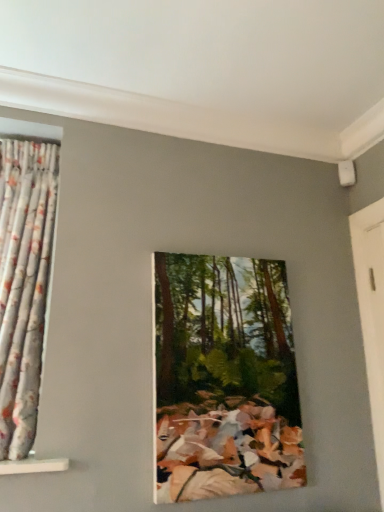
Question: Is white wooden door at right wider or thinner than oil painting of forest at center?

Choices:
 (A) thin
 (B) wide

Answer: (A)

Question: Based on their positions, is white wooden door at right located to the left or right of oil painting of forest at center?

Choices:
 (A) right
 (B) left

Answer: (A)

Question: Based on their relative distances, which object is nearer to the oil painting of forest at center?

Choices:
 (A) white wooden door at right
 (B) floral fabric curtain at left

Answer: (B)

Question: Estimate the real-world distances between objects in this image. Which object is closer to the white wooden door at right?

Choices:
 (A) oil painting of forest at center
 (B) floral fabric curtain at left

Answer: (A)